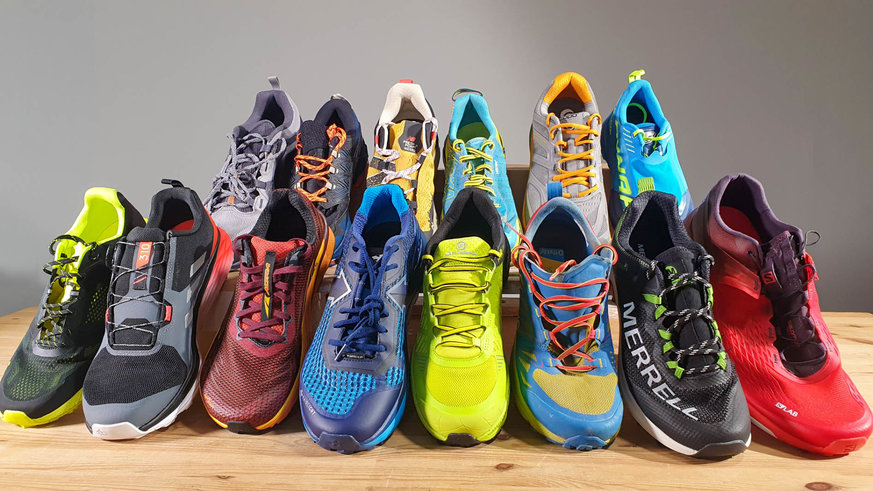
What are the coordinates of `bottom row of shoes` in the screenshot? It's located at (45, 375), (124, 376), (236, 377), (361, 378), (443, 378), (576, 376), (697, 385), (809, 368).